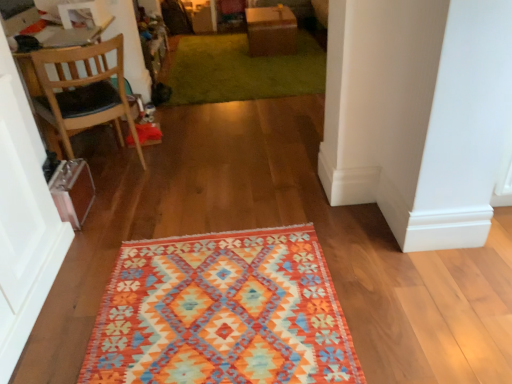
Question: Is brown cardboard box at upper center located outside wooden chair at left?

Choices:
 (A) no
 (B) yes

Answer: (B)

Question: Can you see brown cardboard box at upper center touching wooden chair at left?

Choices:
 (A) no
 (B) yes

Answer: (A)

Question: Is the position of brown cardboard box at upper center less distant than that of wooden chair at left?

Choices:
 (A) yes
 (B) no

Answer: (B)

Question: Does brown cardboard box at upper center have a greater width compared to wooden chair at left?

Choices:
 (A) no
 (B) yes

Answer: (B)

Question: Considering the relative sizes of brown cardboard box at upper center and wooden chair at left in the image provided, is brown cardboard box at upper center smaller than wooden chair at left?

Choices:
 (A) yes
 (B) no

Answer: (A)

Question: Is wooden chair at left wider or thinner than green shaggy rug at upper center?

Choices:
 (A) wide
 (B) thin

Answer: (B)

Question: Is wooden chair at left to the left or to the right of green shaggy rug at upper center in the image?

Choices:
 (A) left
 (B) right

Answer: (A)

Question: Is point (100, 56) positioned closer to the camera than point (270, 74)?

Choices:
 (A) closer
 (B) farther

Answer: (A)

Question: Relative to green shaggy rug at upper center, is wooden chair at left in front or behind?

Choices:
 (A) behind
 (B) front

Answer: (B)

Question: From a real-world perspective, is textured woolen rug at center above or below wooden chair at left?

Choices:
 (A) below
 (B) above

Answer: (A)

Question: Is point (123, 349) closer or farther from the camera than point (143, 167)?

Choices:
 (A) farther
 (B) closer

Answer: (B)

Question: From the image's perspective, relative to wooden chair at left, is textured woolen rug at center above or below?

Choices:
 (A) above
 (B) below

Answer: (B)

Question: Considering the positions of textured woolen rug at center and wooden chair at left in the image, is textured woolen rug at center bigger or smaller than wooden chair at left?

Choices:
 (A) small
 (B) big

Answer: (A)

Question: From the image's perspective, relative to wooden chair at left, is green shaggy rug at upper center above or below?

Choices:
 (A) below
 (B) above

Answer: (B)

Question: From their relative heights in the image, would you say green shaggy rug at upper center is taller or shorter than wooden chair at left?

Choices:
 (A) short
 (B) tall

Answer: (A)